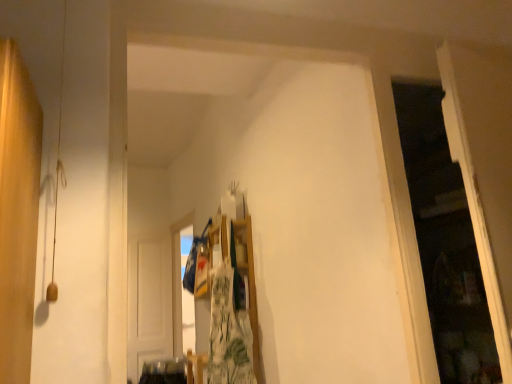
In order to face green floral fabric at center, should I rotate leftwards or rightwards?

It's best to rotate left around 3.337 degrees.

At what (x,y) coordinates should I click in order to perform the action: click on transparent plastic window at upper center. Please return your answer as a coordinate pair (x, y). Looking at the image, I should click on (180, 281).

Where is `green floral fabric at center`? This screenshot has width=512, height=384. green floral fabric at center is located at coordinates (230, 324).

From the image's perspective, which is above, transparent plastic window at upper center or green floral fabric at center?

green floral fabric at center.

Does transparent plastic window at upper center appear on the left side of green floral fabric at center?

Indeed, transparent plastic window at upper center is positioned on the left side of green floral fabric at center.

Is transparent plastic window at upper center next to green floral fabric at center?

There is a gap between transparent plastic window at upper center and green floral fabric at center.

Which is closer, (179,263) or (226,329)?

Point (179,263).

Which is more to the right, green floral fabric at center or white wooden door at center?

Positioned to the right is green floral fabric at center.

From a real-world perspective, is green floral fabric at center below white wooden door at center?

No.

You are a GUI agent. You are given a task and a screenshot of the screen. Output one action in this format:
    pyautogui.click(x=<x>, y=<y>)
    Task: Click on the door below the green floral fabric at center (from a real-world perspective)
    
    Given the screenshot: What is the action you would take?
    pyautogui.click(x=149, y=303)

Is green floral fabric at center inside the boundaries of white wooden door at center, or outside?

green floral fabric at center lies outside white wooden door at center.

Which is farther, (248, 335) or (191, 305)?

The point (191, 305) is more distant.

From the image's perspective, who appears lower, green floral fabric at center or transparent plastic window at upper center?

transparent plastic window at upper center, from the image's perspective.

Considering the sizes of objects green floral fabric at center and transparent plastic window at upper center in the image provided, who is bigger, green floral fabric at center or transparent plastic window at upper center?

transparent plastic window at upper center is bigger.

Can you confirm if green floral fabric at center is wider than transparent plastic window at upper center?

Correct, the width of green floral fabric at center exceeds that of transparent plastic window at upper center.

From a real-world perspective, which is physically below, white wooden door at center or green floral fabric at center?

white wooden door at center is physically lower.

In order to click on laundry positioned vertically above the white wooden door at center (from a real-world perspective) in this screenshot , I will do `click(230, 324)`.

How many degrees apart are the facing directions of white wooden door at center and green floral fabric at center?

There is a 0.438-degree angle between the facing directions of white wooden door at center and green floral fabric at center.

Is white wooden door at center completely or partially outside of green floral fabric at center?

Yes, white wooden door at center is located beyond the bounds of green floral fabric at center.

Considering the positions of objects transparent plastic window at upper center and white wooden door at center in the image provided, who is in front, transparent plastic window at upper center or white wooden door at center?

transparent plastic window at upper center is more forward.

How different are the orientations of transparent plastic window at upper center and white wooden door at center in degrees?

The facing directions of transparent plastic window at upper center and white wooden door at center are 88.3 degrees apart.

Between point (180, 351) and point (143, 362), which one is positioned in front?

The point (143, 362) is closer.

From the image's perspective, which one is positioned higher, transparent plastic window at upper center or white wooden door at center?

transparent plastic window at upper center appears higher in the image.

You are a GUI agent. You are given a task and a screenshot of the screen. Output one action in this format:
    pyautogui.click(x=<x>, y=<y>)
    Task: Click on the door below the transparent plastic window at upper center (from a real-world perspective)
    
    Given the screenshot: What is the action you would take?
    pyautogui.click(x=149, y=303)

Considering the sizes of objects white wooden door at center and transparent plastic window at upper center in the image provided, who is taller, white wooden door at center or transparent plastic window at upper center?

With more height is white wooden door at center.

In the scene shown: Which object is positioned more to the left, white wooden door at center or transparent plastic window at upper center?

white wooden door at center is more to the left.

Is transparent plastic window at upper center located within white wooden door at center?

No.

You are a GUI agent. You are given a task and a screenshot of the screen. Output one action in this format:
    pyautogui.click(x=<x>, y=<y>)
    Task: Click on the laundry lying in front of the transparent plastic window at upper center
    
    Given the screenshot: What is the action you would take?
    pyautogui.click(x=230, y=324)

Where is `door that is below the green floral fabric at center (from the image's perspective)`? This screenshot has height=384, width=512. door that is below the green floral fabric at center (from the image's perspective) is located at coordinates (149, 303).

Looking at the image, which one is located closer to transparent plastic window at upper center, green floral fabric at center or white wooden door at center?

Among the two, white wooden door at center is located nearer to transparent plastic window at upper center.

Which object lies nearer to the anchor point transparent plastic window at upper center, white wooden door at center or green floral fabric at center?

white wooden door at center is positioned closer to the anchor transparent plastic window at upper center.

From the image, which object appears to be nearer to green floral fabric at center, transparent plastic window at upper center or white wooden door at center?

transparent plastic window at upper center is positioned closer to the anchor green floral fabric at center.

When comparing their distances from green floral fabric at center, does white wooden door at center or transparent plastic window at upper center seem closer?

Based on the image, transparent plastic window at upper center appears to be nearer to green floral fabric at center.

Estimate the real-world distances between objects in this image. Which object is further from white wooden door at center, transparent plastic window at upper center or green floral fabric at center?

green floral fabric at center is positioned further to the anchor white wooden door at center.

Looking at the image, which one is located closer to white wooden door at center, green floral fabric at center or transparent plastic window at upper center?

Among the two, transparent plastic window at upper center is located nearer to white wooden door at center.

Where is `window between green floral fabric at center and white wooden door at center along the z-axis`? The width and height of the screenshot is (512, 384). window between green floral fabric at center and white wooden door at center along the z-axis is located at coordinates (180, 281).